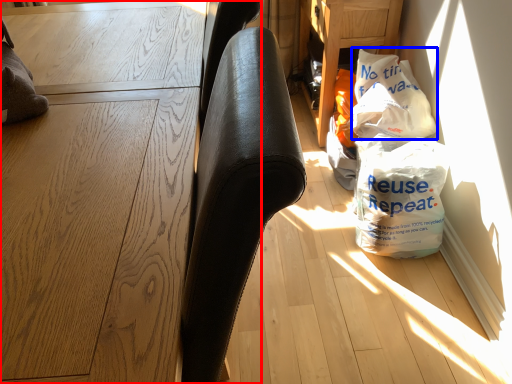
Question: Which point is closer to the camera, furniture (highlighted by a red box) or grocery bag (highlighted by a blue box)?

Choices:
 (A) furniture
 (B) grocery bag

Answer: (A)